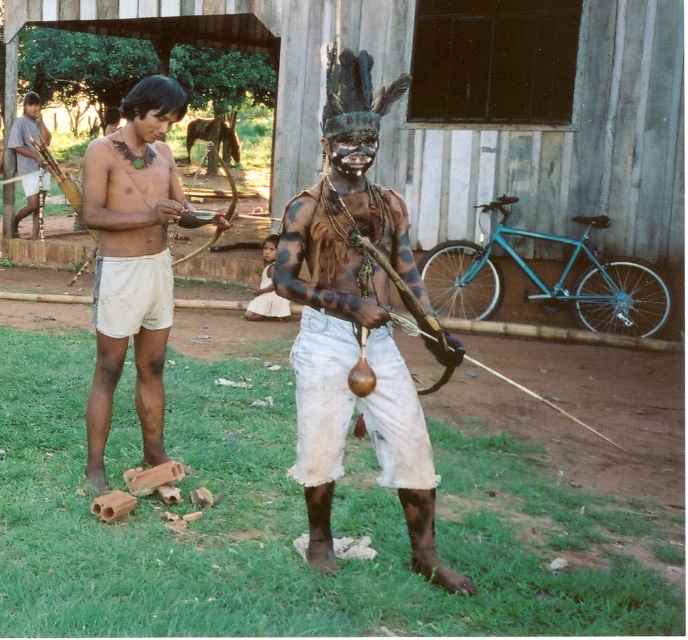
Question: Which point is farther from the camera taking this photo?

Choices:
 (A) click(424, 568)
 (B) click(268, 268)
 (C) click(28, 97)

Answer: (C)

Question: Can you confirm if matte brown wooden stick at left is positioned above white cotton skirt at center?

Choices:
 (A) yes
 (B) no

Answer: (A)

Question: Does matte black bow at center come in front of matte white shorts at center?

Choices:
 (A) no
 (B) yes

Answer: (B)

Question: Is matte white shorts at center smaller than white cotton skirt at center?

Choices:
 (A) no
 (B) yes

Answer: (A)

Question: Which object appears farthest from the camera in this image?

Choices:
 (A) matte white shorts at center
 (B) matte brown wooden stick at left

Answer: (B)

Question: Among these objects, which one is nearest to the camera?

Choices:
 (A) matte white shorts at center
 (B) matte brown wooden stick at left

Answer: (A)